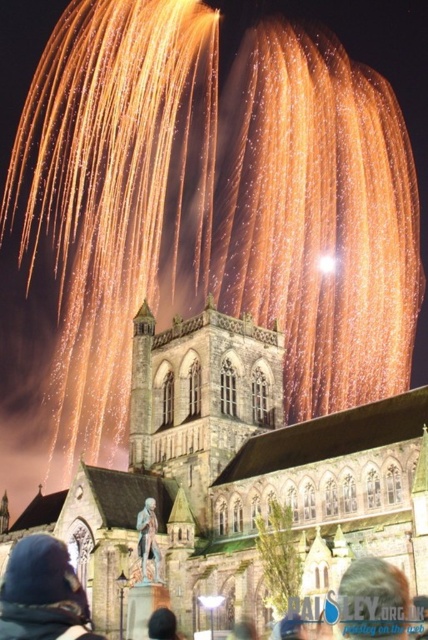
Does dark blue knit hat at lower left appear under blonde hair at center?

Yes.

Between dark blue knit hat at lower left and blonde hair at center, which one has less height?

blonde hair at center

Who is more forward, (73, 616) or (351, 588)?

Point (73, 616) is in front.

The width and height of the screenshot is (428, 640). Find the location of `dark blue knit hat at lower left`. dark blue knit hat at lower left is located at coordinates (41, 593).

In the scene shown: Can you confirm if dark blue knit hat at lower left is thinner than polished bronze statue at lower center?

No, dark blue knit hat at lower left is not thinner than polished bronze statue at lower center.

Is point (44, 586) closer to viewer compared to point (151, 508)?

Yes.

Locate an element on the screen. dark blue knit hat at lower left is located at coordinates (41, 593).

Does point (171, 356) come behind point (365, 625)?

Yes.

Where is `stone church at center`? Image resolution: width=428 pixels, height=640 pixels. stone church at center is located at coordinates (237, 476).

Image resolution: width=428 pixels, height=640 pixels. What are the coordinates of `stone church at center` in the screenshot? It's located at (237, 476).